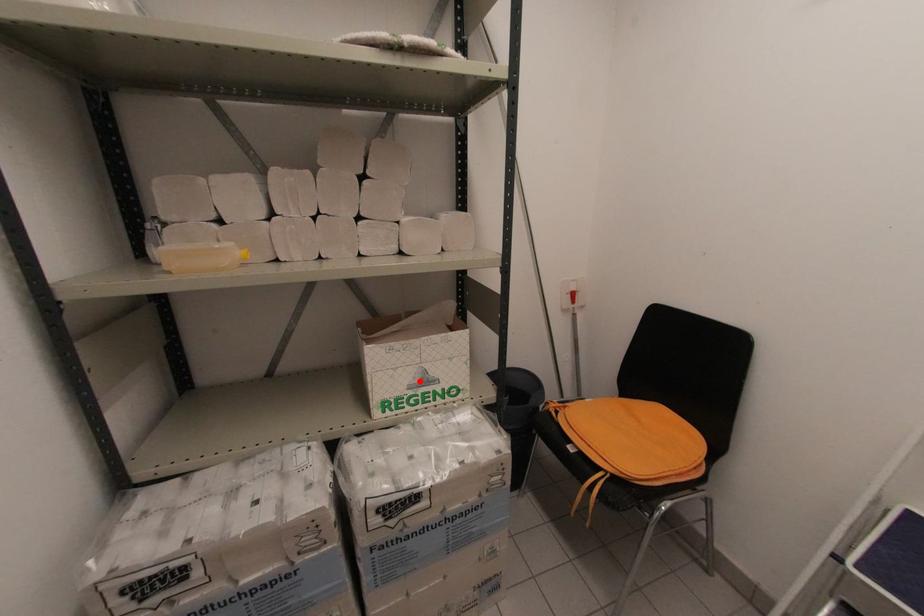
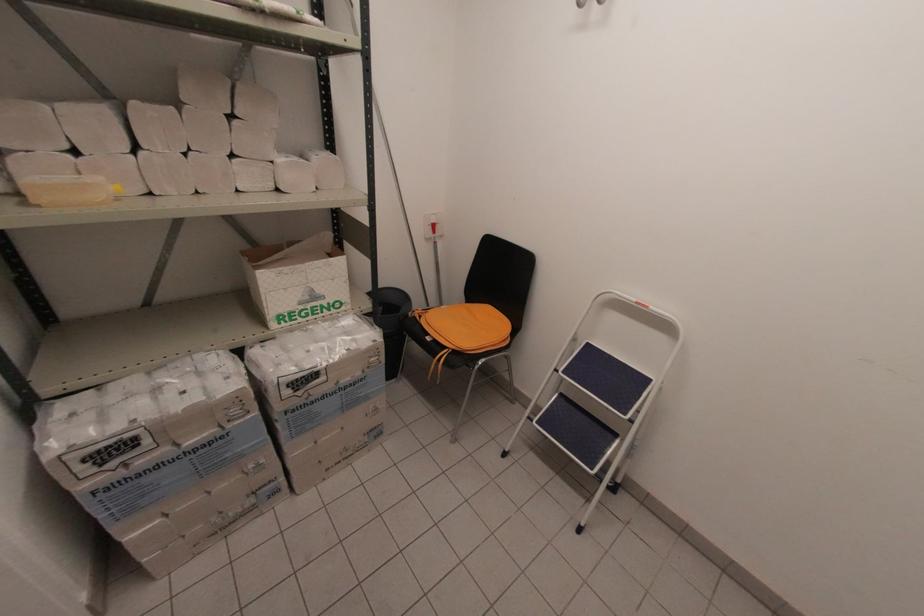
Find the pixel in the second image that matches the highlighted location in the first image.

(309, 298)